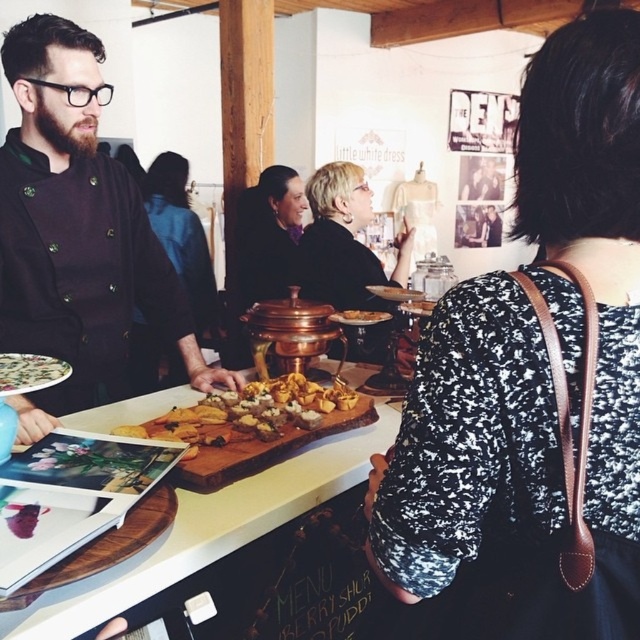
Question: Which point is farther from the camera taking this photo?

Choices:
 (A) 56,621
 (B) 172,432
 (C) 202,236

Answer: (C)

Question: Estimate the real-world distances between objects in this image. Which object is closer to the matte black chef's coat at left?

Choices:
 (A) black textured dress at center
 (B) golden brown cracker at center
 (C) matte copper chafing dish at center

Answer: (B)

Question: Can you confirm if black fabric dress at center is positioned to the right of black velvet dress at center?

Choices:
 (A) no
 (B) yes

Answer: (A)

Question: From the image, what is the correct spatial relationship of black textured dress at center in relation to black velvet dress at center?

Choices:
 (A) right
 (B) left

Answer: (A)

Question: Among these objects, which one is farthest from the camera?

Choices:
 (A) matte white plate at lower left
 (B) matte black dress at center

Answer: (B)

Question: Is matte black chef's coat at left to the left of black velvet dress at center from the viewer's perspective?

Choices:
 (A) yes
 (B) no

Answer: (A)